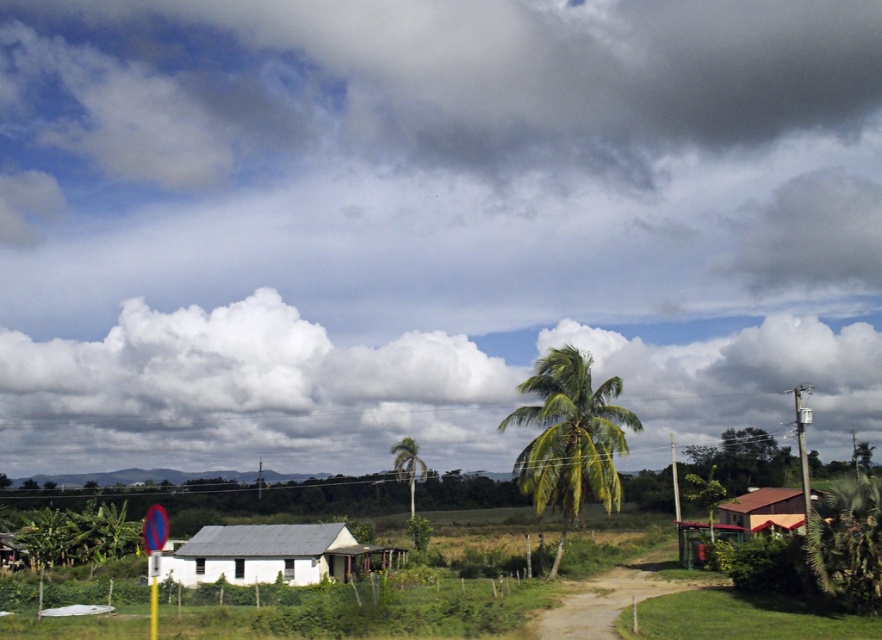
Is green leafy palm at center thinner than white plastic utility pole at right?

Indeed, green leafy palm at center has a lesser width compared to white plastic utility pole at right.

Can you confirm if green leafy palm at center is bigger than white plastic utility pole at right?

Incorrect, green leafy palm at center is not larger than white plastic utility pole at right.

Is point (591, 449) closer to camera compared to point (797, 397)?

No, it is behind (797, 397).

The image size is (882, 640). I want to click on green leafy palm at center, so click(570, 436).

Can you confirm if green leafy palm at center is smaller than green leafy palm tree at center?

Yes.

Which is above, green leafy palm at center or green leafy palm tree at center?

Positioned higher is green leafy palm at center.

Identify the location of green leafy palm at center. tap(570, 436).

Locate an element on the screen. green leafy palm at center is located at coordinates point(570,436).

Does white matte hut at center appear on the left side of green wooden pole at right?

Indeed, white matte hut at center is positioned on the left side of green wooden pole at right.

Does white matte hut at center have a lesser height compared to green wooden pole at right?

Yes.

Locate an element on the screen. The height and width of the screenshot is (640, 882). white matte hut at center is located at coordinates (270, 554).